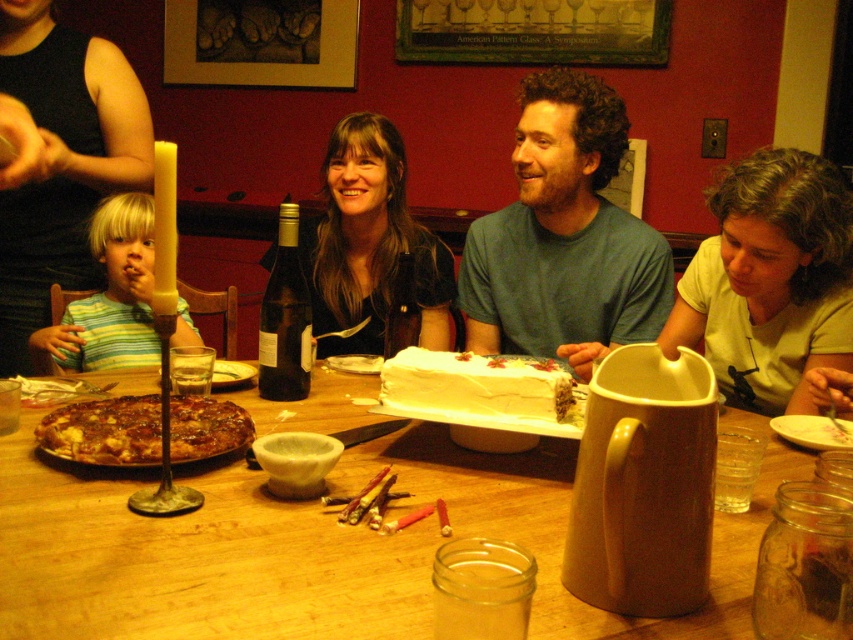
Question: Which point appears closest to the camera in this image?

Choices:
 (A) [532, 404]
 (B) [581, 324]
 (C) [363, 68]

Answer: (A)

Question: Among these objects, which one is farthest from the camera?

Choices:
 (A) white frosting cake at center
 (B) wooden table at center

Answer: (A)

Question: Is green cotton shirt at upper center to the right of striped cotton shirt at left from the viewer's perspective?

Choices:
 (A) yes
 (B) no

Answer: (A)

Question: Does smooth white cake at center appear over white frosting cake at center?

Choices:
 (A) yes
 (B) no

Answer: (A)

Question: Can you confirm if smooth white cake at center is bigger than green cotton shirt at upper center?

Choices:
 (A) yes
 (B) no

Answer: (A)

Question: Which object is positioned closest to the smooth white cake at center?

Choices:
 (A) wooden table at center
 (B) striped cotton shirt at left
 (C) green cotton shirt at upper center
 (D) white frosting cake at center

Answer: (B)